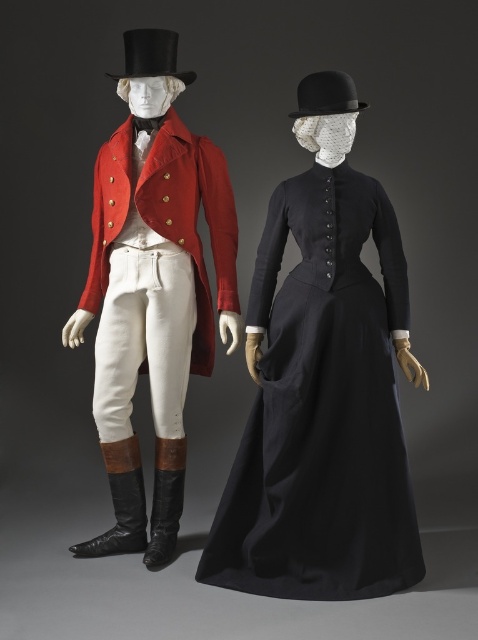
Who is taller, matte red coat at left or black felt bowler hat at upper center?

Standing taller between the two is matte red coat at left.

Between point (209, 186) and point (323, 77), which one is positioned behind?

Positioned behind is point (209, 186).

Find the location of a particular element. This screenshot has height=640, width=478. matte red coat at left is located at coordinates (193, 220).

What do you see at coordinates (165, 500) in the screenshot?
I see `leather at center` at bounding box center [165, 500].

Between leather at center and black felt bowler hat at upper center, which one has more height?

leather at center is taller.

Where is `leather at center`? This screenshot has height=640, width=478. leather at center is located at coordinates (165, 500).

Is brown leather boot at lower left closer to the viewer compared to black felt bowler hat at upper center?

No, it is behind black felt bowler hat at upper center.

You are a GUI agent. You are given a task and a screenshot of the screen. Output one action in this format:
    pyautogui.click(x=<x>, y=<y>)
    Task: Click on the brown leather boot at lower left
    
    Given the screenshot: What is the action you would take?
    pyautogui.click(x=120, y=502)